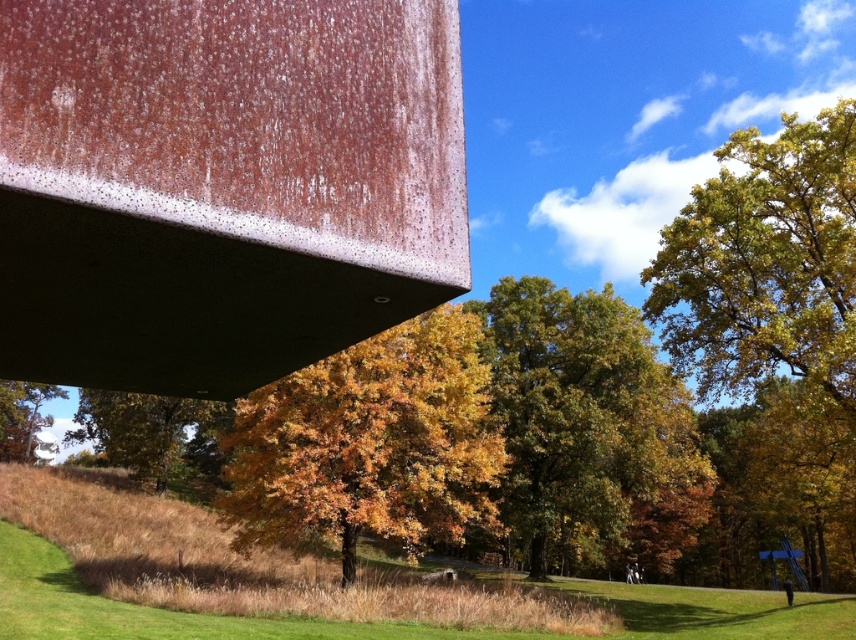
Question: Is golden yellow leaves at right below yellow-orange leaves at center?

Choices:
 (A) no
 (B) yes

Answer: (B)

Question: Does yellow-orange leaves at center appear on the right side of yellow-green leaves at center?

Choices:
 (A) yes
 (B) no

Answer: (A)

Question: Can you confirm if golden yellow leaves at right is smaller than yellow-orange leaves at center?

Choices:
 (A) yes
 (B) no

Answer: (B)

Question: Among these objects, which one is nearest to the camera?

Choices:
 (A) golden yellow leaves at center
 (B) yellow-orange leaves at center
 (C) green matte tree at lower left

Answer: (B)

Question: Estimate the real-world distances between objects in this image. Which object is closer to the yellow-green leaves at center?

Choices:
 (A) golden yellow leaves at center
 (B) golden yellow leaves at right

Answer: (A)

Question: Which object is closer to the camera taking this photo?

Choices:
 (A) yellow-orange leaves at center
 (B) golden yellow leaves at right
 (C) golden yellow leaves at center
 (D) yellow-green leaves at center

Answer: (A)